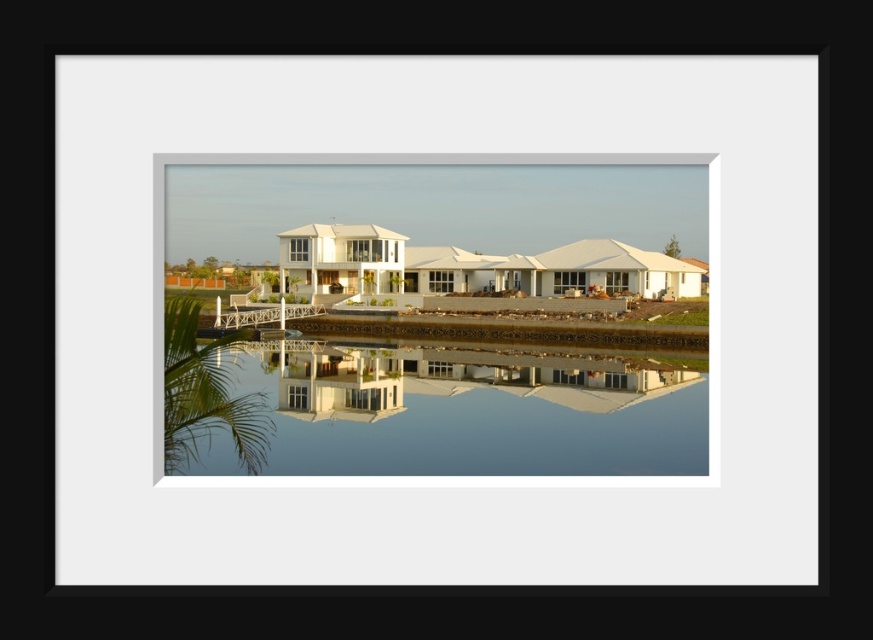
Describe the element at coordinates (445, 317) in the screenshot. I see `white glossy house at center` at that location.

Which is above, white glossy house at center or clear glass water at center?

white glossy house at center is higher up.

Who is more forward, [448,208] or [388,374]?

Point [388,374]

Find the location of a particular element. Image resolution: width=873 pixels, height=640 pixels. white glossy house at center is located at coordinates (445, 317).

Is white glossy house at center shorter than white wooden dock at center?

No, white glossy house at center is not shorter than white wooden dock at center.

Who is shorter, white glossy house at center or white wooden dock at center?

Standing shorter between the two is white wooden dock at center.

Locate an element on the screen. Image resolution: width=873 pixels, height=640 pixels. white glossy house at center is located at coordinates (445, 317).

Identify the location of white glossy house at center. The width and height of the screenshot is (873, 640). (445, 317).

Can you confirm if clear glass water at center is positioned to the right of white wooden dock at center?

Indeed, clear glass water at center is positioned on the right side of white wooden dock at center.

Who is taller, clear glass water at center or white wooden dock at center?

clear glass water at center

Where is `clear glass water at center`? clear glass water at center is located at coordinates (471, 412).

Identify the location of clear glass water at center. (471, 412).